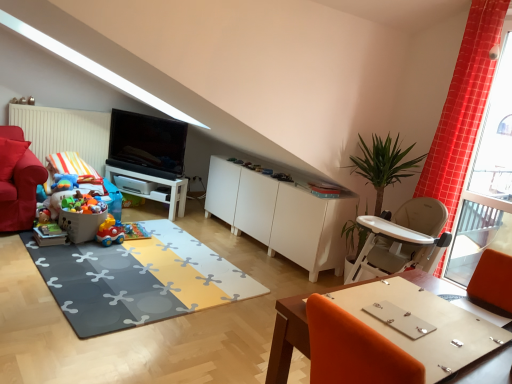
Locate an element on the screen. plastic toy car at lower left, which is the 3th toy in bottom-to-top order is located at coordinates pos(81,225).

Describe the element at coordinates (81, 225) in the screenshot. I see `plastic toy car at lower left, the second toy positioned from the top` at that location.

In order to face satin black tv at center, should I rotate leftwards or rightwards?

Turn left approximately 14.273 degrees to face it.

You are a GUI agent. You are given a task and a screenshot of the screen. Output one action in this format:
    pyautogui.click(x=<x>, y=<y>)
    Task: Click on the blue plush toy at left, the first toy viewed from the top
    
    Given the screenshot: What is the action you would take?
    pyautogui.click(x=64, y=182)

The image size is (512, 384). Describe the element at coordinates (138, 279) in the screenshot. I see `soft rubber mat at center` at that location.

What are the coordinates of `white glossy table at center, placed as the second table when sorted from right to left` in the screenshot? It's located at (159, 185).

What is the approximate height of wooden table at lower right, placed as the 2th table when sorted from left to right?

The height of wooden table at lower right, placed as the 2th table when sorted from left to right, is 20.03 inches.

In order to face matte plastic toy at lower left, acting as the fourth toy starting from the top, should I rotate leftwards or rightwards?

Rotate left and turn 25.952 degrees.

At what (x,y) coordinates should I click in order to perform the action: click on plastic toy car at lower left, the second toy positioned from the top. Please return your answer as a coordinate pair (x, y). Looking at the image, I should click on (81, 225).

Is plastic toy car at lower left, which is the 3th toy in bottom-to-top order, to the left of soft rubber mat at center from the viewer's perspective?

Yes.

Considering the relative positions of plastic toy car at lower left, which is the 3th toy in bottom-to-top order, and soft rubber mat at center in the image provided, is plastic toy car at lower left, which is the 3th toy in bottom-to-top order, behind soft rubber mat at center?

Yes, plastic toy car at lower left, which is the 3th toy in bottom-to-top order, is further from the viewer.

Between point (85, 239) and point (144, 275), which one is positioned behind?

Positioned behind is point (85, 239).

Considering the sizes of plastic toy car at lower left, which is the 3th toy in bottom-to-top order, and soft rubber mat at center in the image, is plastic toy car at lower left, which is the 3th toy in bottom-to-top order, wider or thinner than soft rubber mat at center?

Clearly, plastic toy car at lower left, which is the 3th toy in bottom-to-top order, has less width compared to soft rubber mat at center.

Between satin black tv at center and white matte cabinet at center, which one has more height?

Standing taller between the two is white matte cabinet at center.

Is satin black tv at center beside white matte cabinet at center?

There is a gap between satin black tv at center and white matte cabinet at center.

Does satin black tv at center have a larger size compared to white matte cabinet at center?

Incorrect, satin black tv at center is not larger than white matte cabinet at center.

From a real-world perspective, is satin black tv at center physically above white matte cabinet at center?

Indeed, from a real-world perspective, satin black tv at center stands above white matte cabinet at center.

Is white matte cabinet at center looking in the opposite direction of soft rubber mat at center?

No.

Is white matte cabinet at center wider than soft rubber mat at center?

No.

Locate an element on the screen. cabinetry that is above the soft rubber mat at center (from a real-world perspective) is located at coordinates (280, 215).

Considering the relative sizes of white matte cabinet at center and white glossy table at center, the first table in the back-to-front sequence, in the image provided, is white matte cabinet at center thinner than white glossy table at center, the first table in the back-to-front sequence,?

No.

From a real-world perspective, is white matte cabinet at center physically above white glossy table at center, the first table in the back-to-front sequence?

Indeed, from a real-world perspective, white matte cabinet at center stands above white glossy table at center, the first table in the back-to-front sequence.

Between white matte cabinet at center and white glossy table at center, acting as the first table starting from the top, which one has more height?

white matte cabinet at center.

Image resolution: width=512 pixels, height=384 pixels. What are the coordinates of `cabinetry in front of the white glossy table at center, placed as the second table when sorted from right to left` in the screenshot? It's located at (x=280, y=215).

Is green leafy plant at right taller or shorter than red checkered curtain at right?

In the image, green leafy plant at right appears to be shorter than red checkered curtain at right.

Is green leafy plant at right positioned far away from red checkered curtain at right?

That's not correct — green leafy plant at right is a little close to red checkered curtain at right.

What are the coordinates of `houseplant located behind the red checkered curtain at right` in the screenshot? It's located at (383, 165).

Is green leafy plant at right wider than red checkered curtain at right?

Yes.

Does point (61, 188) come farther from viewer compared to point (402, 174)?

Yes, it is.

From a real-world perspective, is blue plush toy at left, the first toy viewed from the top, located beneath green leafy plant at right?

Yes, from a real-world perspective, blue plush toy at left, the first toy viewed from the top, is beneath green leafy plant at right.

Is blue plush toy at left, marked as the fourth toy in a bottom-to-top arrangement, positioned beyond the bounds of green leafy plant at right?

That's correct, blue plush toy at left, marked as the fourth toy in a bottom-to-top arrangement, is outside of green leafy plant at right.

Is plastic toy car at lower left, which is the 3th toy in bottom-to-top order, inside white glossy table at center, which is the second table from front to back?

Actually, plastic toy car at lower left, which is the 3th toy in bottom-to-top order, is outside white glossy table at center, which is the second table from front to back.

Considering the points (163, 184) and (71, 232), which point is in front, point (163, 184) or point (71, 232)?

The point (71, 232) is closer to the camera.

How different are the orientations of white glossy table at center, which is the second table from front to back, and plastic toy car at lower left, which is the 3th toy in bottom-to-top order, in degrees?

The facing directions of white glossy table at center, which is the second table from front to back, and plastic toy car at lower left, which is the 3th toy in bottom-to-top order, are 75.8 degrees apart.

Considering the positions of objects white glossy table at center, the 2th table from the bottom, and plastic toy car at lower left, the second toy positioned from the top, in the image provided, who is more to the left, white glossy table at center, the 2th table from the bottom, or plastic toy car at lower left, the second toy positioned from the top,?

plastic toy car at lower left, the second toy positioned from the top.

You are a GUI agent. You are given a task and a screenshot of the screen. Output one action in this format:
    pyautogui.click(x=<x>, y=<y>)
    Task: Click on the mat that is in front of the plastic toy car at lower left, the second toy positioned from the top
    Image resolution: width=512 pixels, height=384 pixels.
    Given the screenshot: What is the action you would take?
    pyautogui.click(x=138, y=279)

There is a white matte cabinet at center. At what (x,y) coordinates should I click in order to perform the action: click on entertainment center above it (from a real-world perspective). Please return your answer as a coordinate pair (x, y). The width and height of the screenshot is (512, 384). Looking at the image, I should click on (149, 153).

From the image, which object appears to be farther from plastic toy car at lower left, the second toy positioned from the top, white glossy table at center, the first table in the back-to-front sequence, or soft rubber mat at center?

white glossy table at center, the first table in the back-to-front sequence, is further to plastic toy car at lower left, the second toy positioned from the top.

When comparing their distances from white matte cabinet at center, does white glossy table at center, the 2th table from the bottom, or red checkered curtain at right seem closer?

white glossy table at center, the 2th table from the bottom, is positioned closer to the anchor white matte cabinet at center.

Looking at the image, which one is located closer to satin black tv at center, white glossy table at center, placed as the second table when sorted from right to left, or red checkered curtain at right?

Based on the image, white glossy table at center, placed as the second table when sorted from right to left, appears to be nearer to satin black tv at center.

Based on their spatial positions, is white glossy table at center, the 2th table from the bottom, or green leafy plant at right closer to velvet red armchair at left?

white glossy table at center, the 2th table from the bottom, lies closer to velvet red armchair at left than the other object.

Which object lies nearer to the anchor point matte plastic toy at lower left, positioned as the first toy in bottom-to-top order, satin black tv at center or red checkered curtain at right?

satin black tv at center is closer to matte plastic toy at lower left, positioned as the first toy in bottom-to-top order.

Estimate the real-world distances between objects in this image. Which object is closer to soft rubber mat at center, wooden table at lower right, which is the 1th table from front to back, or plastic toy car at lower left, the second toy positioned from the top?

plastic toy car at lower left, the second toy positioned from the top, is closer to soft rubber mat at center.

From the image, which object appears to be farther from blue plush toy at left, marked as the fourth toy in a bottom-to-top arrangement, plastic matte car at center, positioned as the second toy in bottom-to-top order, or white glossy table at center, arranged as the first table when viewed from the left?

white glossy table at center, arranged as the first table when viewed from the left, lies further to blue plush toy at left, marked as the fourth toy in a bottom-to-top arrangement, than the other object.

Looking at the image, which one is located closer to plastic matte car at center, positioned as the second toy in bottom-to-top order, satin black tv at center or matte plastic toy at lower left, acting as the fourth toy starting from the top?

matte plastic toy at lower left, acting as the fourth toy starting from the top, is positioned closer to the anchor plastic matte car at center, positioned as the second toy in bottom-to-top order.

Find the location of a particular element. This screenshot has height=384, width=512. table between plastic toy car at lower left, which is the 3th toy in bottom-to-top order, and white matte cabinet at center from left to right is located at coordinates (159, 185).

Locate an element on the screen. Image resolution: width=512 pixels, height=384 pixels. cabinetry positioned between wooden table at lower right, the 2th table viewed from the back, and matte plastic toy at lower left, positioned as the first toy in bottom-to-top order, from near to far is located at coordinates (280, 215).

I want to click on entertainment center located between plastic toy car at lower left, which is the 3th toy in bottom-to-top order, and white glossy table at center, arranged as the first table when viewed from the left, in the depth direction, so click(149, 153).

This screenshot has width=512, height=384. Identify the location of entertainment center located between blue plush toy at left, the first toy viewed from the top, and white glossy table at center, acting as the first table starting from the top, in the depth direction. coord(149,153).